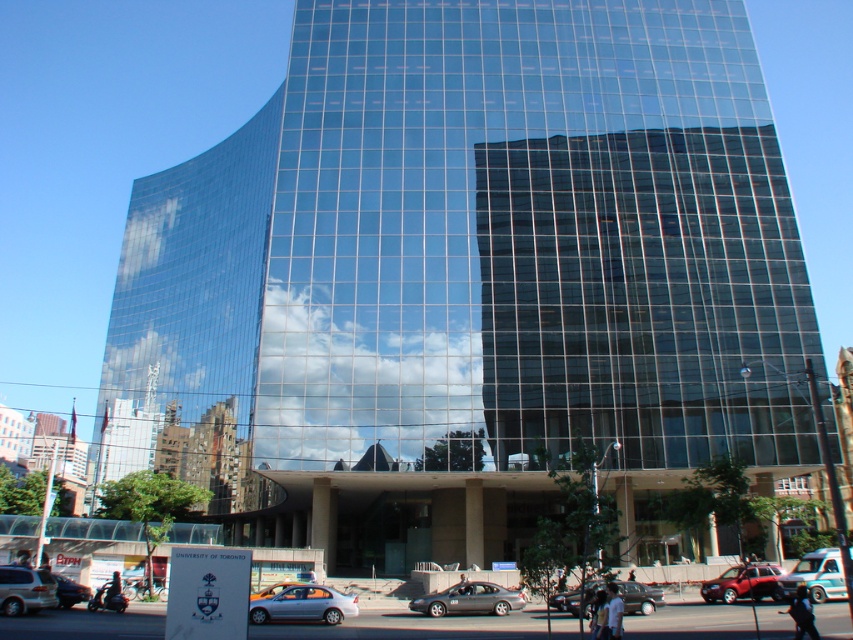
You are a delivery driver who needs to park your vehicle in the parking lot near the modern building. You have a silver metallic sedan at center and a teal glossy van at center. Which vehicle will require more space to park?

The teal glossy van at center is larger than the silver metallic sedan at center, so it will require more space to park.

You are a photographer trying to capture the reflection of the shiny red car at lower right and the shiny silver sedan at lower center in the building. Since the building has a curved section at the top left, which car might be more challenging to fully capture in the reflection?

The shiny red car at lower right has a lesser height compared to the shiny silver sedan at lower center. Therefore, the shiny silver sedan at lower center might be more challenging to fully capture in the reflection because its greater height may require a wider or higher angle to include its entire reflection in the curved section of the building.